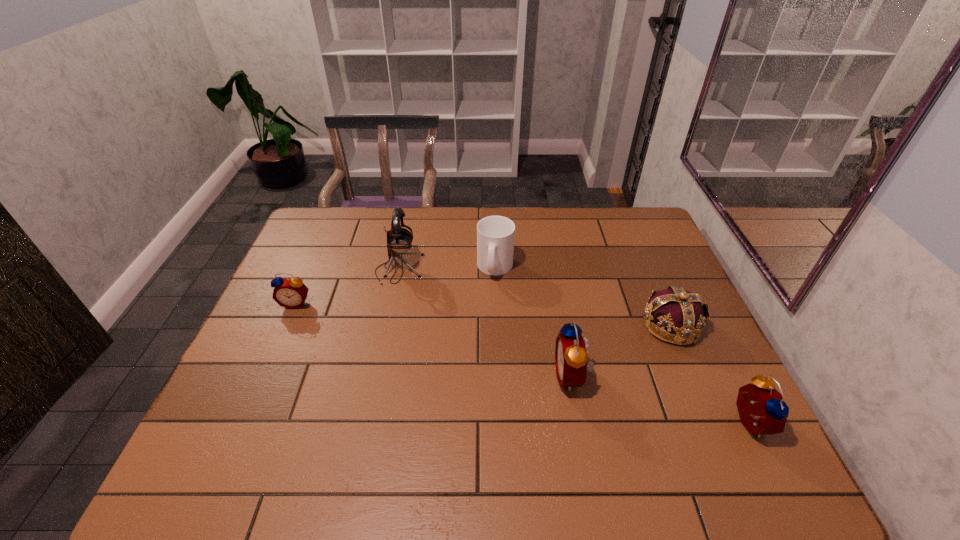
Locate an element on the screen. The width and height of the screenshot is (960, 540). free location located 0.190m on the front-facing side of the leftmost alarm clock is located at coordinates (270, 363).

The image size is (960, 540). What are the coordinates of `vacant space positioned 0.300m on the front-facing side of the fourth object from left to right` in the screenshot? It's located at (436, 376).

The image size is (960, 540). I want to click on vacant space located on the front-facing side of the fourth object from left to right, so click(424, 376).

Where is `free region located 0.240m on the front-facing side of the fourth object from left to right`? free region located 0.240m on the front-facing side of the fourth object from left to right is located at coordinates (460, 376).

Find the location of a particular element. This screenshot has width=960, height=540. free space located on the handle side of the fourth object from right to left is located at coordinates (496, 308).

Where is `free spot located 0.210m on the back of the fifth object from right to left`? free spot located 0.210m on the back of the fifth object from right to left is located at coordinates (410, 218).

The width and height of the screenshot is (960, 540). Find the location of `free space located on the back of the crown`. free space located on the back of the crown is located at coordinates (655, 287).

At what (x,y) coordinates should I click in order to perform the action: click on object that is at the near edge. Please return your answer as a coordinate pair (x, y). The height and width of the screenshot is (540, 960). Looking at the image, I should click on (762, 411).

This screenshot has height=540, width=960. I want to click on object that is at the left edge, so click(291, 293).

This screenshot has width=960, height=540. Find the location of `alarm clock at the right edge`. alarm clock at the right edge is located at coordinates (762, 411).